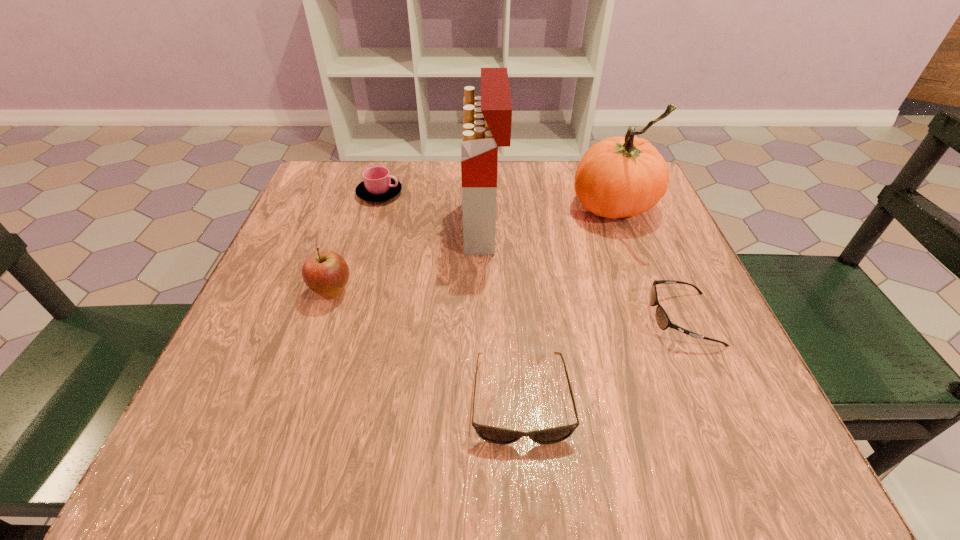
Locate an element on the screen. cigarette case is located at coordinates point(487,121).

Locate an element on the screen. The width and height of the screenshot is (960, 540). pumpkin is located at coordinates tap(618, 177).

This screenshot has width=960, height=540. I want to click on the third tallest object, so click(x=326, y=273).

Identify the location of cup. (378, 185).

At what (x,y) coordinates should I click in order to perform the action: click on the farther sunglasses. Please return your answer as a coordinate pair (x, y). Looking at the image, I should click on (662, 319).

This screenshot has width=960, height=540. I want to click on the nearest object, so click(x=491, y=434).

Identify the location of the left sunglasses. This screenshot has width=960, height=540. (491, 434).

Image resolution: width=960 pixels, height=540 pixels. Identify the location of free space located with the lid open on the cigarette case. (443, 227).

Locate an element on the screen. Image resolution: width=960 pixels, height=540 pixels. vacant point located with the lid open on the cigarette case is located at coordinates (383, 227).

Where is `free space located with the lid open on the cigarette case`? The height and width of the screenshot is (540, 960). free space located with the lid open on the cigarette case is located at coordinates (370, 227).